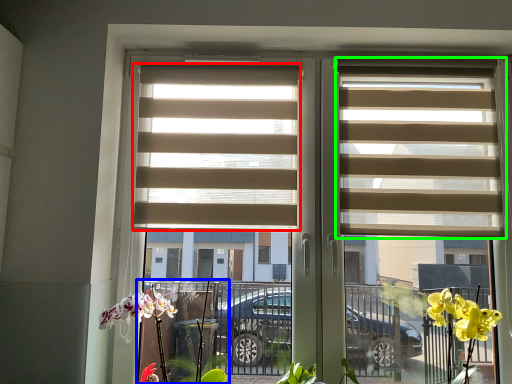
Question: Which object is positioned closest to window blind (highlighted by a red box)? Select from plant (highlighted by a blue box) and window blind (highlighted by a green box).

Choices:
 (A) plant
 (B) window blind

Answer: (B)